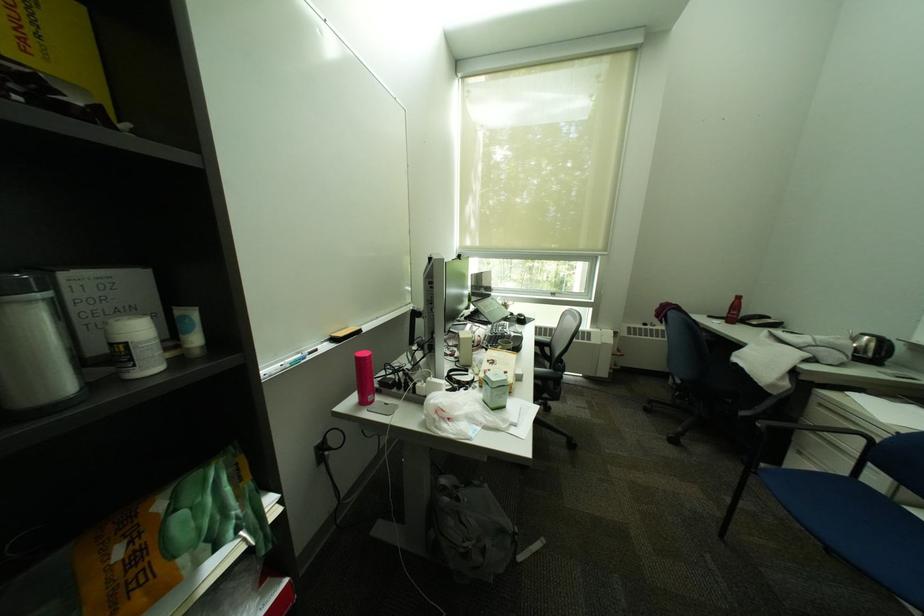
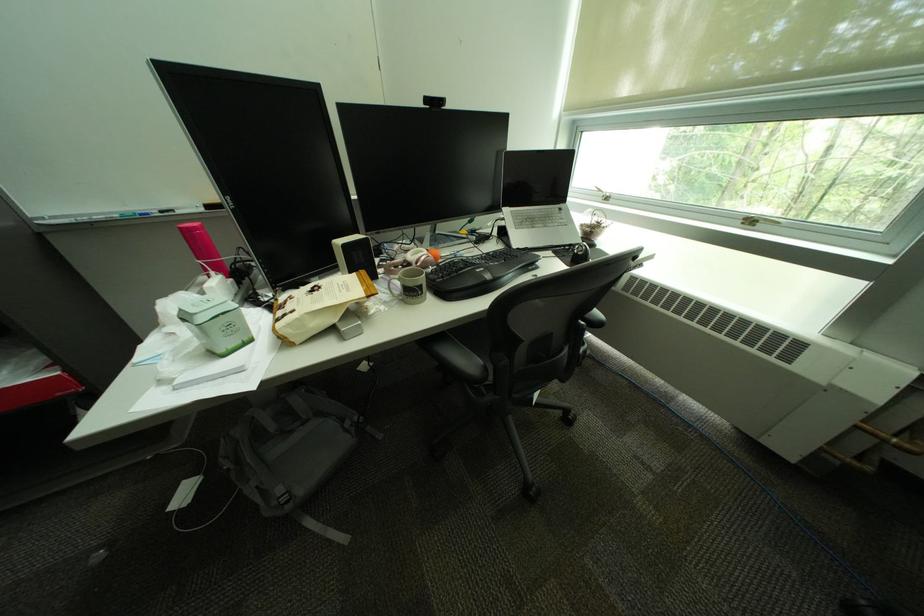
Locate, in the second image, the point that corresponds to point (528, 540) in the first image.

(299, 508)